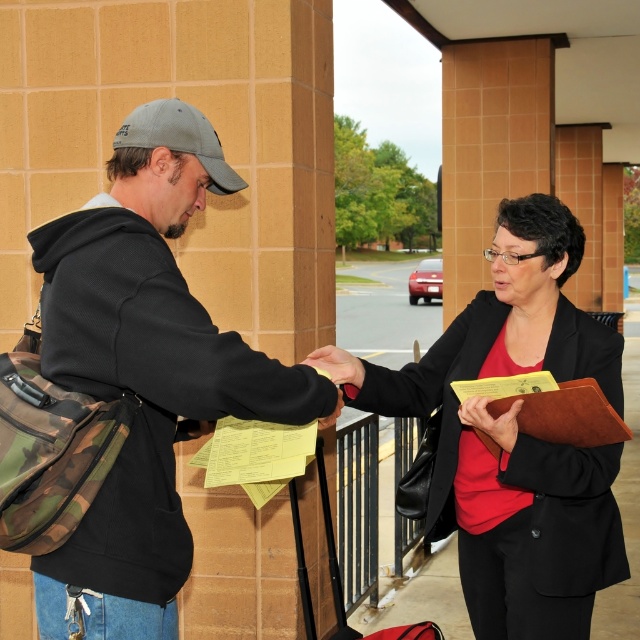
Question: Does camo fabric bag at left have a lesser width compared to matte black blazer at center?

Choices:
 (A) yes
 (B) no

Answer: (A)

Question: Which object is closer to the camera taking this photo?

Choices:
 (A) matte black blazer at center
 (B) camo fabric bag at left

Answer: (B)

Question: Which point is farther to the camera?

Choices:
 (A) matte black blazer at center
 (B) camo fabric bag at left

Answer: (A)

Question: Can you confirm if camo fabric bag at left is positioned to the left of matte black blazer at center?

Choices:
 (A) no
 (B) yes

Answer: (B)

Question: Which point appears farthest from the camera in this image?

Choices:
 (A) (536, 568)
 (B) (186, 541)

Answer: (A)

Question: From the image, what is the correct spatial relationship of camo fabric bag at left in relation to matte black blazer at center?

Choices:
 (A) above
 (B) below

Answer: (A)